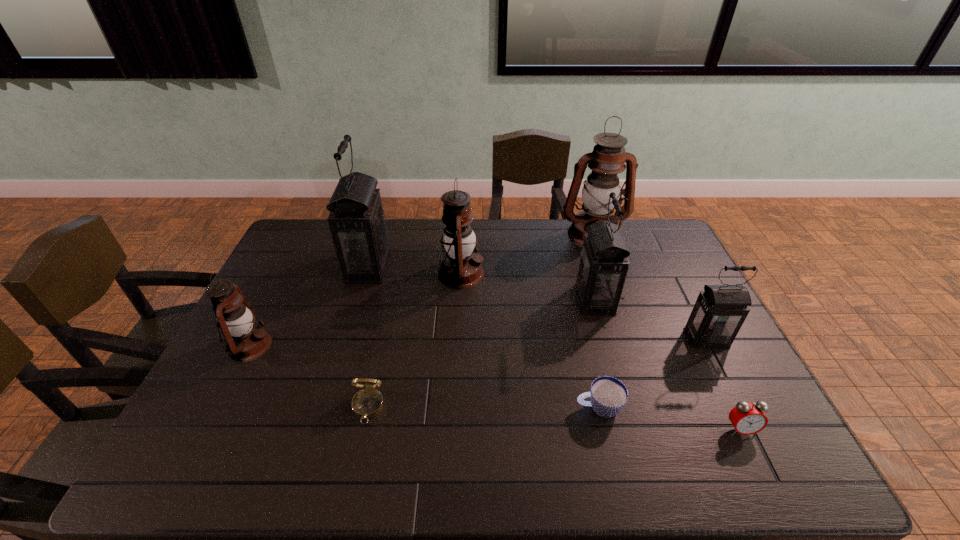
Locate an element on the screen. Image resolution: width=960 pixels, height=540 pixels. vacant point located on the front-facing side of the second smallest gray lantern is located at coordinates (522, 300).

Identify the location of vacant area situated 0.120m on the front-facing side of the rightmost gray lantern. (731, 387).

At what (x,y) coordinates should I click in order to perform the action: click on vacant space situated on the side of the leftmost brown lantern, there is a wick adjustment knob. Please return your answer as a coordinate pair (x, y). The height and width of the screenshot is (540, 960). Looking at the image, I should click on (292, 346).

You are a GUI agent. You are given a task and a screenshot of the screen. Output one action in this format:
    pyautogui.click(x=<x>, y=<y>)
    Task: Click on the vacant space located 0.060m on the front-facing side of the red alarm clock
    
    Given the screenshot: What is the action you would take?
    pyautogui.click(x=756, y=463)

You are a GUI agent. You are given a task and a screenshot of the screen. Output one action in this format:
    pyautogui.click(x=<x>, y=<y>)
    Task: Click on the vacant space situated with the dial facing the compass
    
    Given the screenshot: What is the action you would take?
    pyautogui.click(x=353, y=474)

The height and width of the screenshot is (540, 960). I want to click on free space located on the side of the shortest object with the handle, so pos(555,408).

Identify the location of vacant space located 0.060m on the side of the shortest object with the handle. The image size is (960, 540). (551, 408).

Locate an element on the screen. The image size is (960, 540). free spot located 0.150m on the side of the shortest object with the handle is located at coordinates (516, 408).

This screenshot has height=540, width=960. In order to click on object present at the left edge in this screenshot , I will do `click(246, 341)`.

At what (x,y) coordinates should I click in order to perform the action: click on alarm clock that is positioned at the right edge. Please return your answer as a coordinate pair (x, y). Looking at the image, I should click on (747, 418).